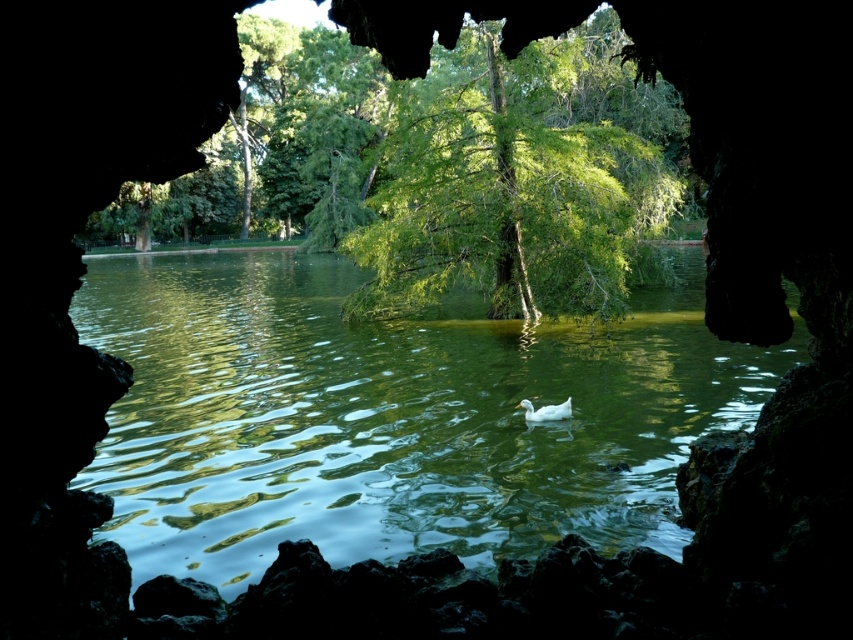
You are standing inside the cave and want to take a photo of the green smooth water at center and the green leafy tree at center. Which object will appear bigger in your photo?

The green smooth water at center will appear bigger in the photo because it has a larger size compared to the green leafy tree at center.

You are standing inside the cave and want to see the green smooth water at center. Based on the coordinates provided, in which direction should you look to see it?

The green smooth water at center is located at coordinates point (392, 417), so you should look towards the right and slightly above the center point to see it.